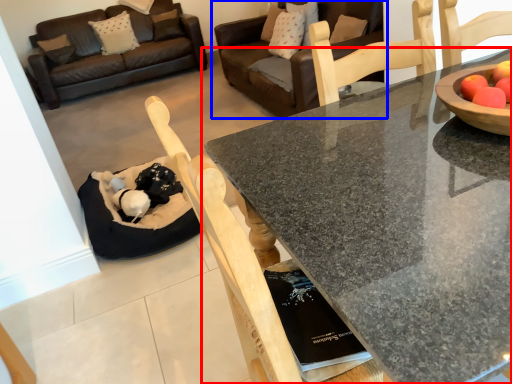
Question: Which of the following is the farthest to the observer, coffee table (highlighted by a red box) or studio couch (highlighted by a blue box)?

Choices:
 (A) coffee table
 (B) studio couch

Answer: (B)